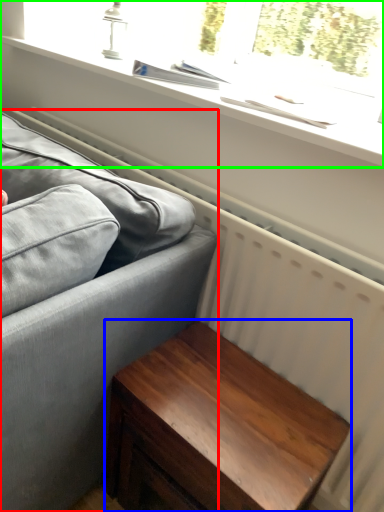
Question: Based on their relative distances, which object is nearer to studio couch (highlighted by a red box)? Choose from table (highlighted by a blue box) and window (highlighted by a green box).

Choices:
 (A) table
 (B) window

Answer: (A)